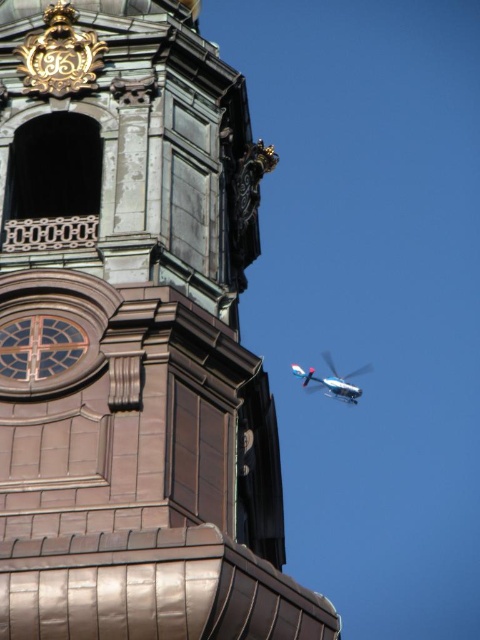
You are standing in front of the historic building and want to take a photo of the brown stone tower at center and the metallic silver helicopter at upper right. Which object will appear larger in your photo?

The brown stone tower at center will appear larger in the photo because it is closer to the viewer than the metallic silver helicopter at upper right.

You are standing in the middle of the scene and want to take a photo of both the brown stone tower at center and the metallic silver helicopter at upper right. Which object is positioned higher in your view?

The brown stone tower at center is above the metallic silver helicopter at upper right, so it is positioned higher in your view.

You are standing at the camera position and want to take a photo of the brown stone tower at center. The camera has a maximum focus range of 35 meters. Will you be able to focus on the tower?

The brown stone tower at center and camera are 37.78 meters apart from each other. Since the maximum focus range is 35 meters, the tower is beyond the camera range. Therefore, the camera cannot focus on the tower.